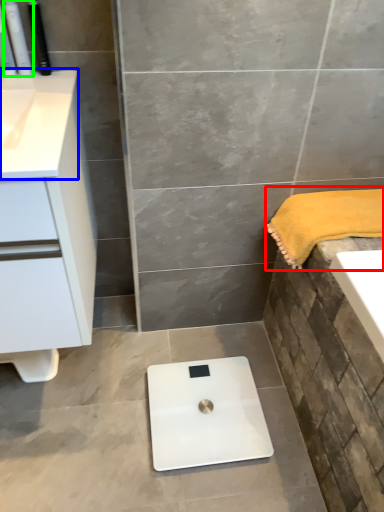
Question: Which object is the farthest from bath towel (highlighted by a red box)? Choose among these: counter top (highlighted by a blue box) or toiletry (highlighted by a green box).

Choices:
 (A) counter top
 (B) toiletry

Answer: (B)